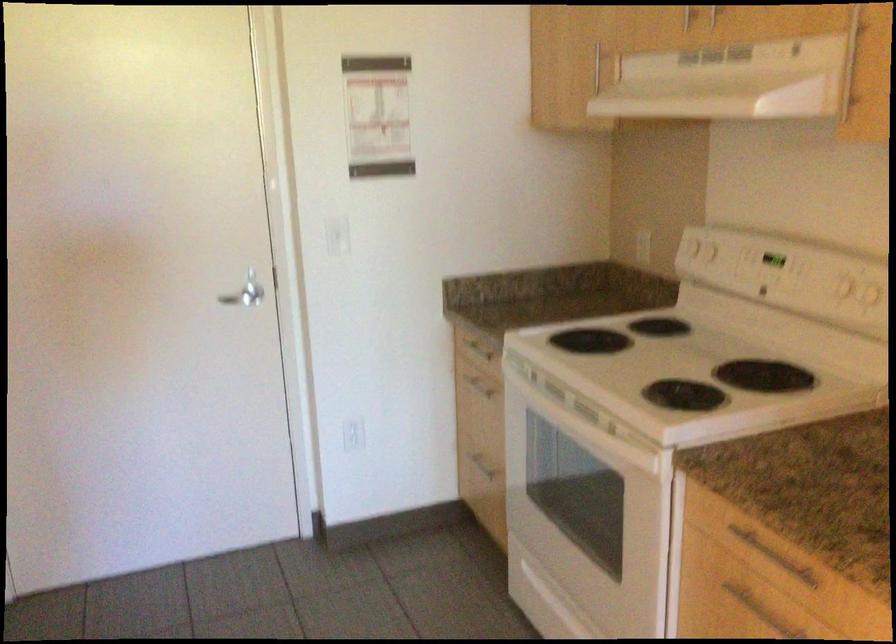
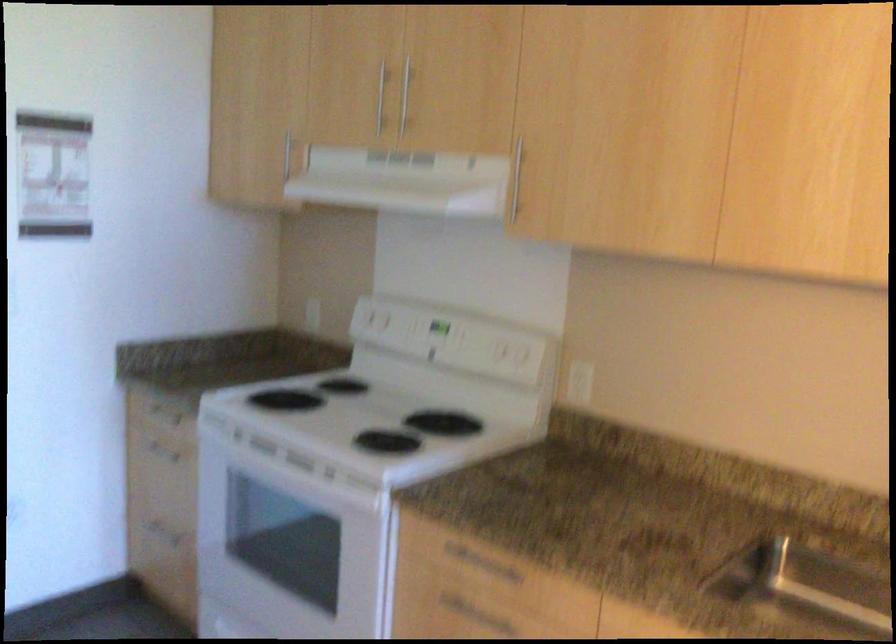
In the second image, find the point that corresponds to the point at 771,547 in the first image.

(480, 564)